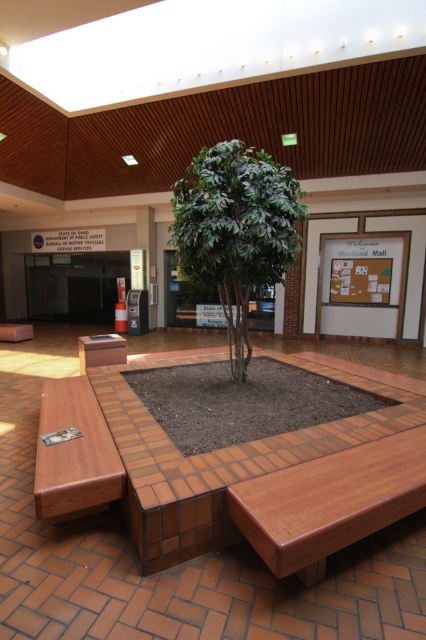
Question: Estimate the real-world distances between objects in this image. Which object is closer to the green leafy tree at center?

Choices:
 (A) wooden bench at center
 (B) brown wood bench at lower left

Answer: (A)

Question: Which point appears closest to the camera in this image?

Choices:
 (A) pos(66,496)
 (B) pos(284,220)

Answer: (A)

Question: Can you confirm if green leafy tree at center is wider than brown wood bench at lower left?

Choices:
 (A) yes
 (B) no

Answer: (A)

Question: Can you confirm if green leafy tree at center is positioned to the left of brown wood bench at lower left?

Choices:
 (A) no
 (B) yes

Answer: (A)

Question: Is wooden bench at center to the right of brown wood bench at lower left from the viewer's perspective?

Choices:
 (A) yes
 (B) no

Answer: (A)

Question: Estimate the real-world distances between objects in this image. Which object is closer to the wooden bench at center?

Choices:
 (A) brown wood bench at lower left
 (B) wooden bench at lower left

Answer: (B)